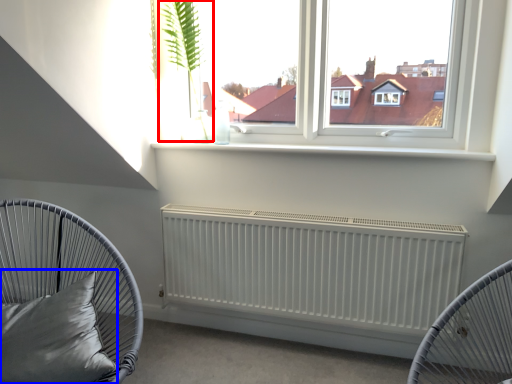
Question: Among these objects, which one is nearest to the camera, plant (highlighted by a red box) or pillow (highlighted by a blue box)?

Choices:
 (A) plant
 (B) pillow

Answer: (B)